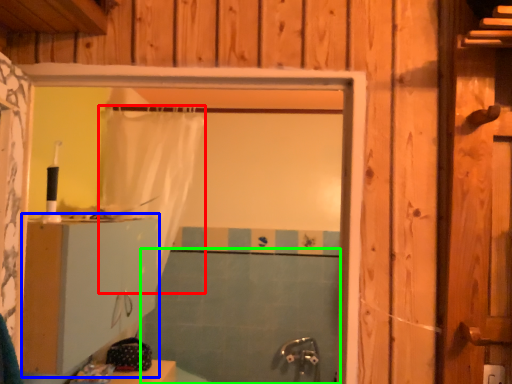
Question: Based on their relative distances, which object is nearer to shower curtain (highlighted by a red box)? Choose from dresser (highlighted by a blue box) and bath (highlighted by a green box).

Choices:
 (A) dresser
 (B) bath

Answer: (A)